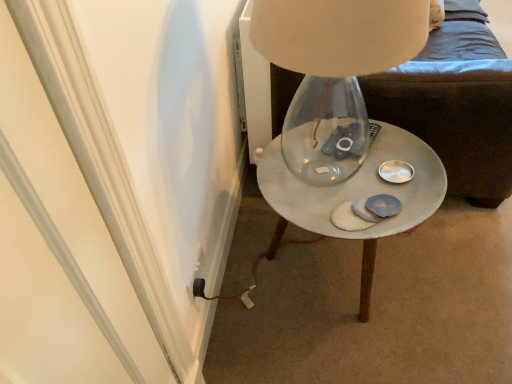
Find the location of a particular element. This screenshot has height=384, width=512. free space in front of white marble side table at center is located at coordinates (354, 353).